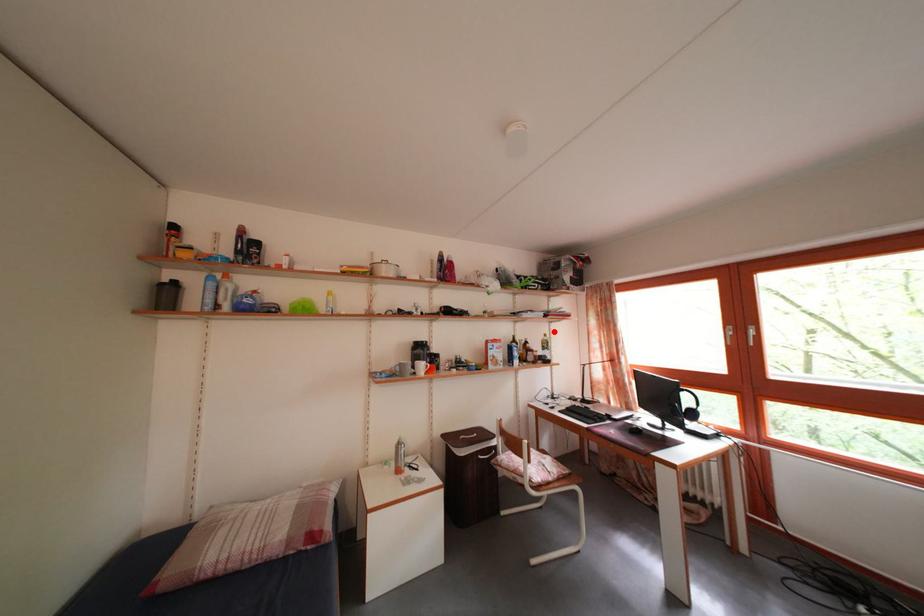
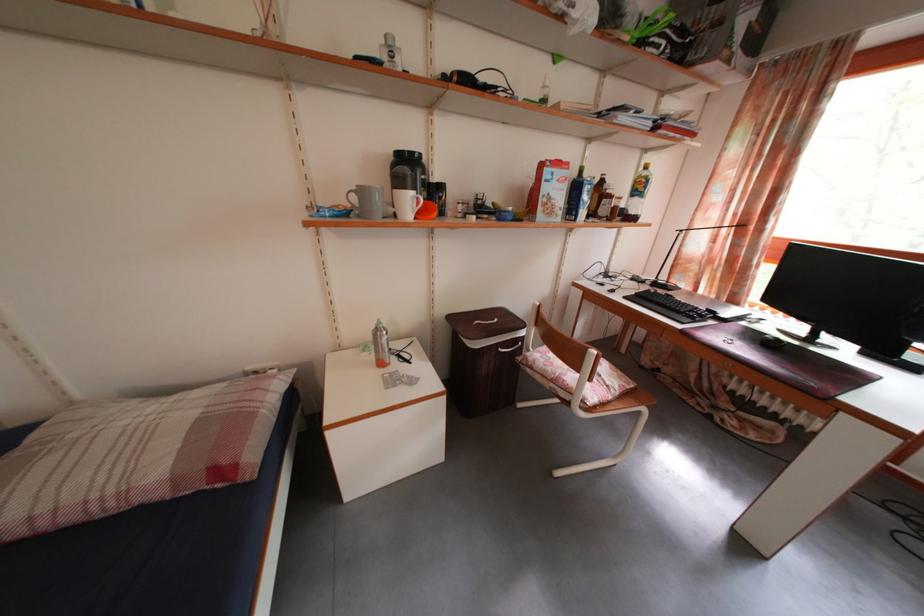
Question: I am providing you with two images of the same scene from different viewpoints. A red point is marked on the first image. At the location where the point appears in image 1, is it still visible in image 2?

Choices:
 (A) Yes
 (B) No

Answer: (A)